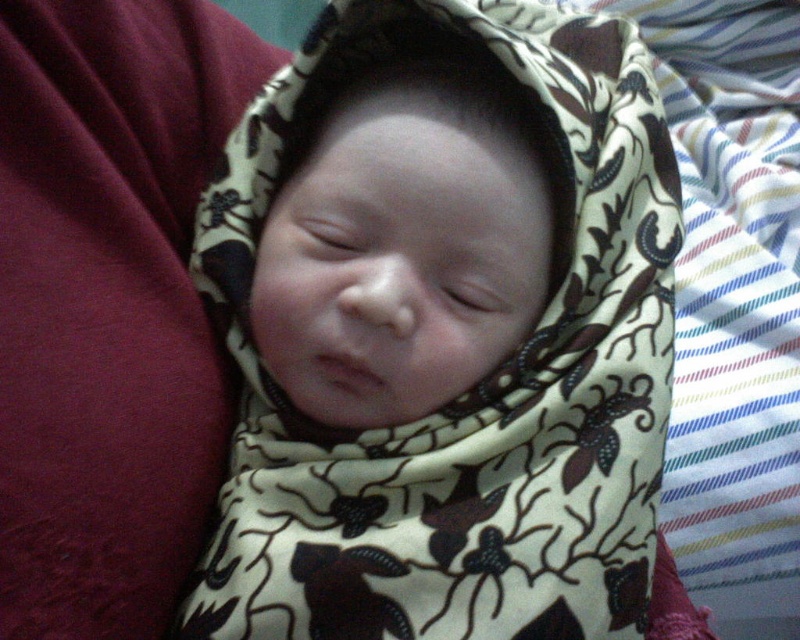
You are a parent trying to choose between two fabrics to wrap your baby. The brown printed fabric at center and the smooth beige swaddle at center are both available. Based on their sizes, which fabric would you recommend for a snugger fit?

The smooth beige swaddle at center is narrower than the brown printed fabric at center, so it would provide a snugger fit for the baby.

You are a parent trying to change the baby from the brown printed fabric at center to the smooth beige swaddle at center. Which fabric should you move first to access the baby?

The brown printed fabric at center is in front of the smooth beige swaddle at center, so you should move the brown printed fabric at center first to access the baby.